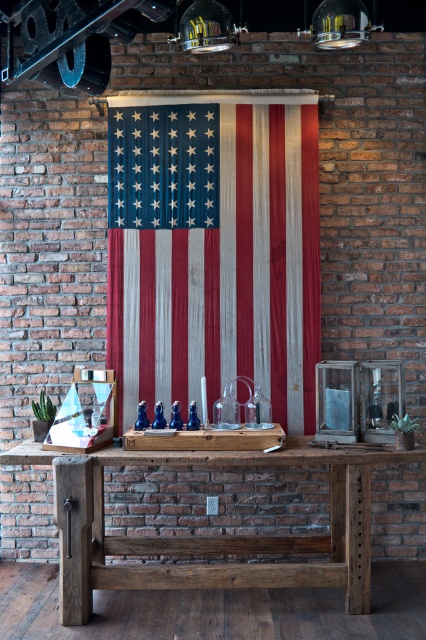
Is rustic wood american flag at center wider than rustic wood table at center?

No, rustic wood american flag at center is not wider than rustic wood table at center.

Is rustic wood american flag at center positioned at the back of rustic wood table at center?

That is True.

Who is more distant from viewer, (164, 280) or (342, 518)?

The point (164, 280) is more distant.

Find the location of `rustic wood american flag at center`. rustic wood american flag at center is located at coordinates (227, 275).